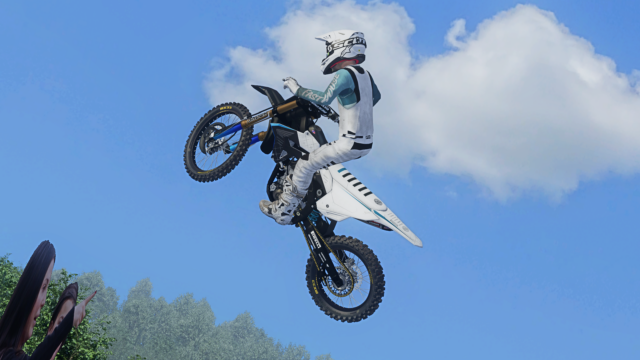
Locate an element on the screen. The width and height of the screenshot is (640, 360). seat is located at coordinates (333, 212).